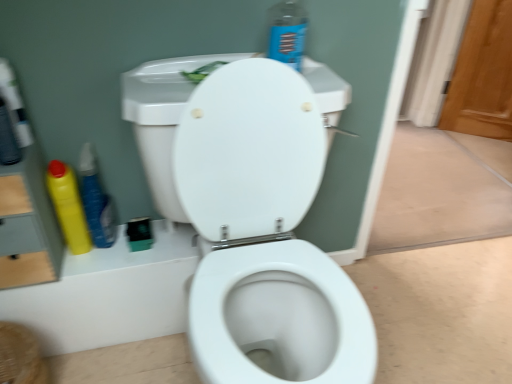
Question: Would you say wooden screen door at right is inside or outside yellow plastic bottle at left, arranged as the second cleaning product when viewed from the right?

Choices:
 (A) outside
 (B) inside

Answer: (A)

Question: In the image, is wooden screen door at right positioned in front of or behind yellow plastic bottle at left, arranged as the second cleaning product when viewed from the right?

Choices:
 (A) behind
 (B) front

Answer: (A)

Question: Estimate the real-world distances between objects in this image. Which object is farther from the yellow plastic bottle at left, which ranks as the second cleaning product in left-to-right order?

Choices:
 (A) yellow plastic bottle at left, the 1th cleaning product in the left-to-right sequence
 (B) wooden screen door at right
 (C) blue plastic spray bottle at upper center, arranged as the third cleaning product when viewed from the left

Answer: (B)

Question: Considering the real-world distances, which object is farthest from the yellow plastic bottle at left, which ranks as the second cleaning product in left-to-right order?

Choices:
 (A) yellow plastic bottle at left, which appears as the 3th cleaning product when viewed from the right
 (B) wooden screen door at right
 (C) blue plastic spray bottle at upper center, placed as the 1th cleaning product when sorted from right to left

Answer: (B)